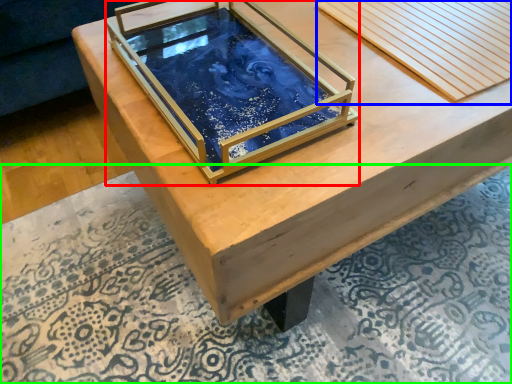
Question: Considering the real-world distances, which object is farthest from glass box (highlighted by a red box)? plank (highlighted by a blue box) or mat (highlighted by a green box)?

Choices:
 (A) plank
 (B) mat

Answer: (B)